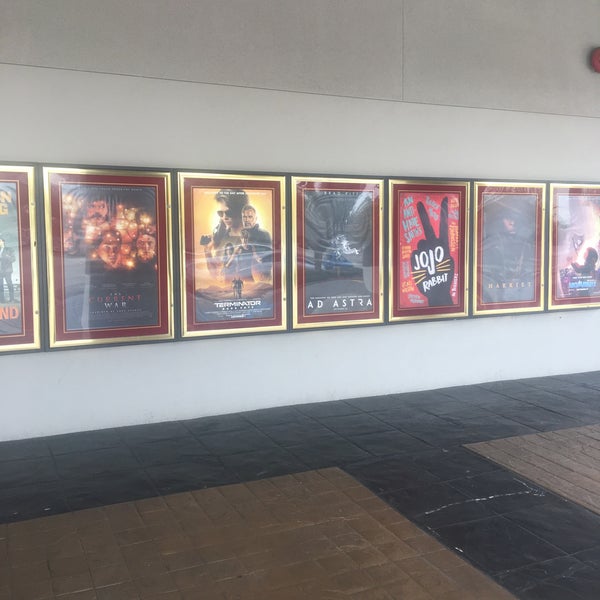
The image size is (600, 600). In order to click on poster frame in this screenshot , I will do `click(27, 168)`.